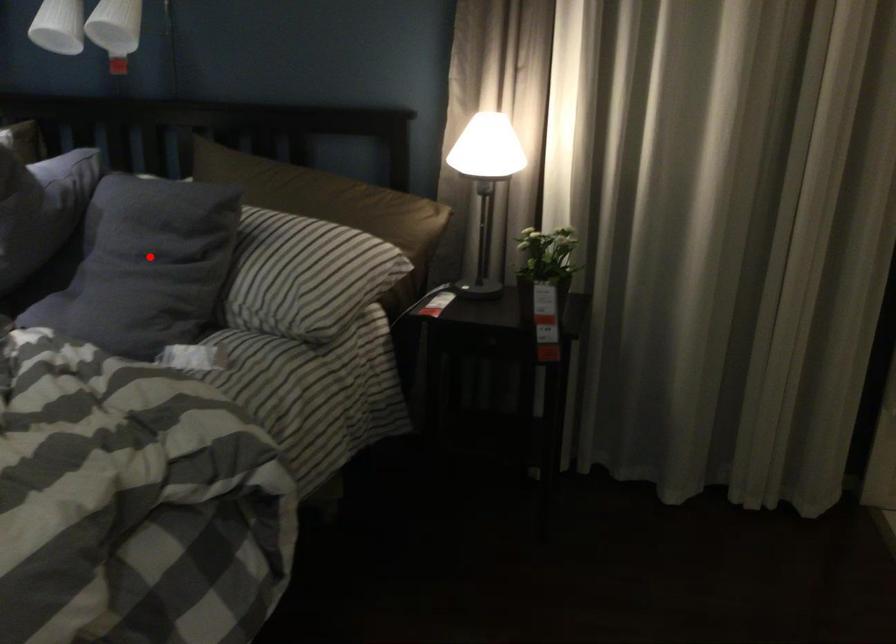
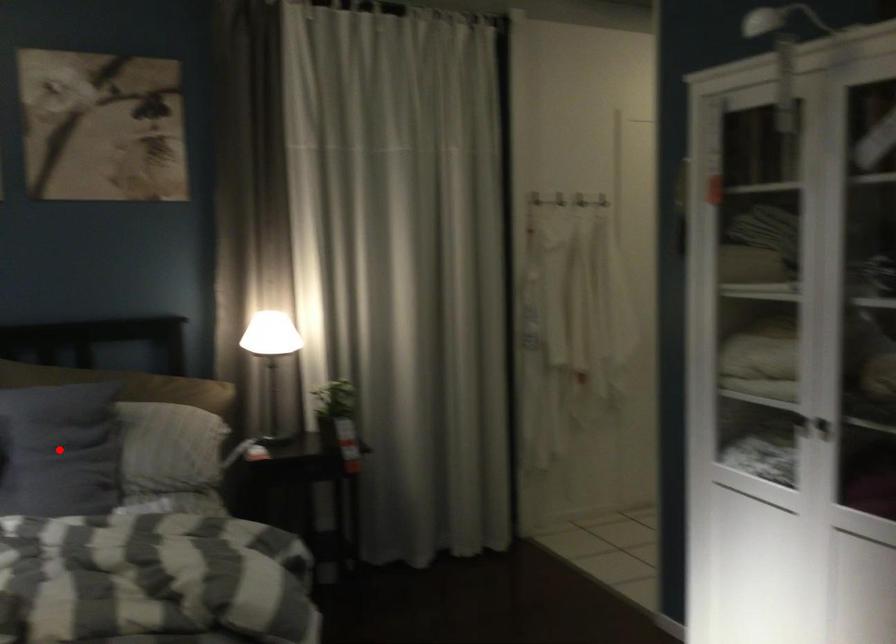
I am providing you with two images of the same scene from different viewpoints. A red point is marked on the first image and another point is marked on the second image. Is the red point in image1 aligned with the point shown in image2?

Yes